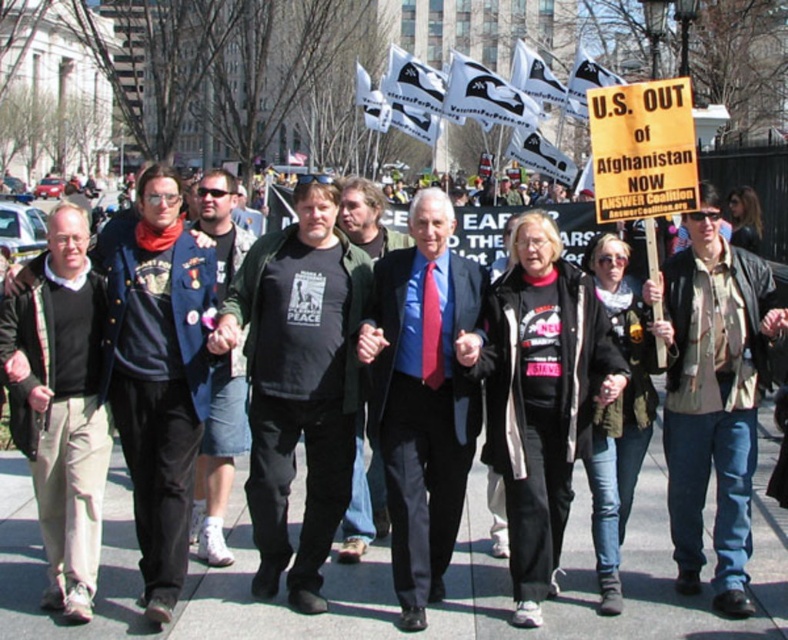
You are a photographer trying to capture a photo of the protest march. You notice two jackets in the crowd, the khaki cotton jacket at center and the dark blue jacket at left. Which jacket should you focus on if you want to capture the one that appears bigger in the photo?

The khaki cotton jacket at center is larger in size than the dark blue jacket at left, so focusing on the khaki cotton jacket at center will capture the bigger one in the photo.

You are a photographer standing at the front of the protest march. You want to take a photo that includes both the point at coordinates point (x=396, y=596) and the point at coordinates point (x=209, y=428). Which point will appear larger in your photo?

Point (x=396, y=596) will appear larger in the photo because it is closer to the camera than point (x=209, y=428).

You are a delivery drone flying over the protest march. You need to land on the gray concrete sidewalk at center to drop off a package. What coordinates should you aim for?

The gray concrete sidewalk at center is located at point [497,586], so you should aim for those coordinates to land there.